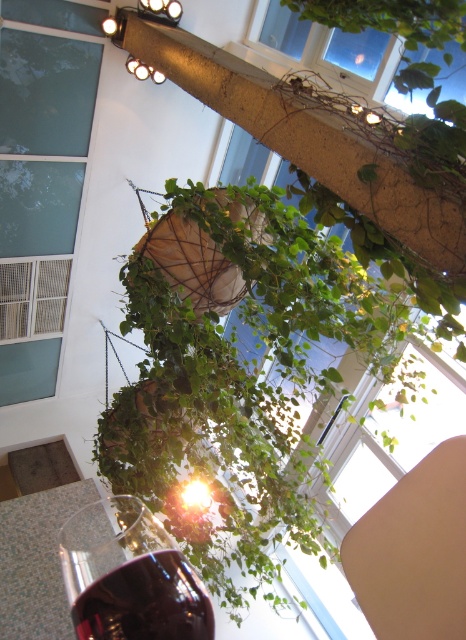
You are an interior designer planning to install a new lighting fixture in this space. You notice the green leafy plant at center and the transparent glass at center. Which object is located beneath the other?

The green leafy plant at center is positioned under transparent glass at center.

You are standing in the atrium and see a green leafy plant at center. There is a point marked at coordinates (x=239, y=381). Is this point located on the green leafy plant at center?

Yes, the point marked at coordinates (x=239, y=381) is located on the green leafy plant at center.